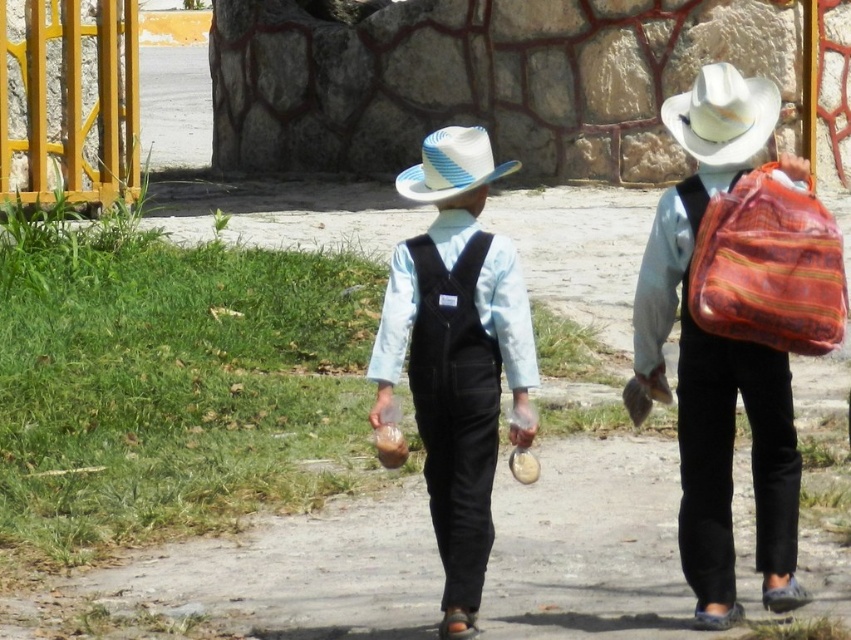
Question: Is matte orange fabric bag at right closer to camera compared to white woven hat at upper right?

Choices:
 (A) yes
 (B) no

Answer: (B)

Question: Among these points, which one is farthest from the camera?

Choices:
 (A) (493, 176)
 (B) (764, 205)
 (C) (472, 312)
 (D) (707, 604)

Answer: (A)

Question: Which of these objects is positioned farthest from the white woven hat at upper right?

Choices:
 (A) matte orange fabric bag at right
 (B) matte straw hat at center

Answer: (B)

Question: Among these points, which one is farthest from the camera?

Choices:
 (A) (722, 230)
 (B) (695, 224)
 (C) (427, 448)
 (D) (483, 157)

Answer: (C)

Question: Does matte straw hat at center have a greater width compared to textured woven bag at right?

Choices:
 (A) no
 (B) yes

Answer: (B)

Question: Is matte straw hat at center wider than blue and white striped straw hat at center?

Choices:
 (A) yes
 (B) no

Answer: (B)